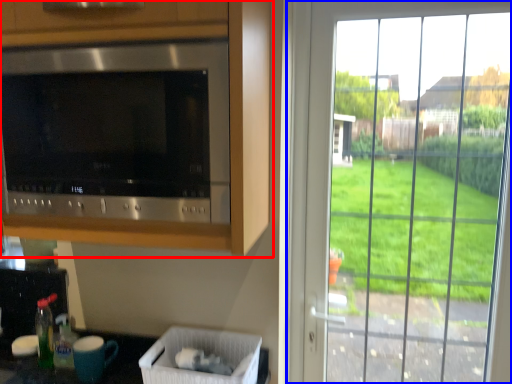
Question: Among these objects, which one is nearest to the camera, cabinetry (highlighted by a red box) or window (highlighted by a blue box)?

Choices:
 (A) cabinetry
 (B) window

Answer: (A)